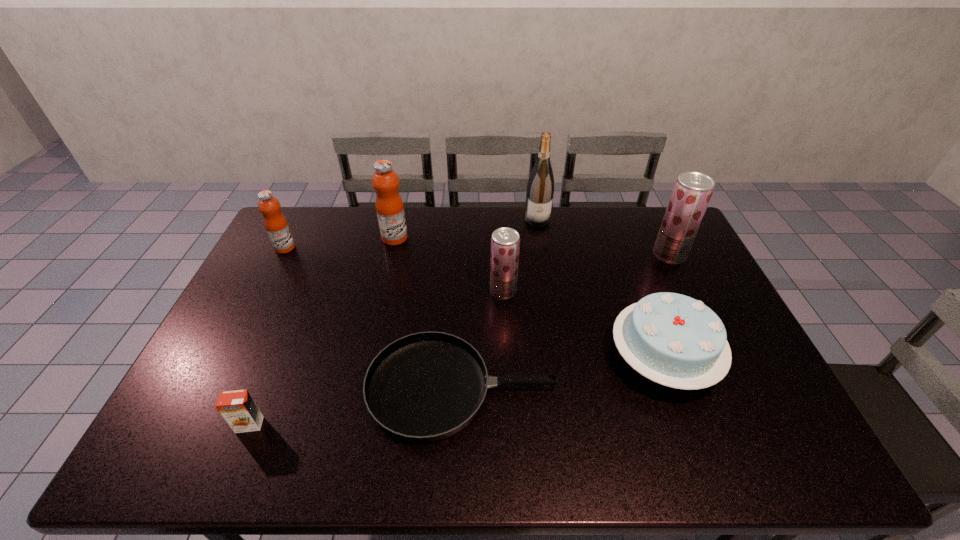
Image resolution: width=960 pixels, height=540 pixels. I want to click on vacant space that is in between the bigger strawberry fruit juice and the brown wine bottle, so click(x=603, y=237).

Locate an element on the screen. Image resolution: width=960 pixels, height=540 pixels. unoccupied area between the smaller orange fruit juice and the right strawberry fruit juice is located at coordinates (477, 251).

The width and height of the screenshot is (960, 540). I want to click on vacant space that is in between the left strawberry fruit juice and the right strawberry fruit juice, so click(587, 273).

Locate an element on the screen. free space between the brown wine bottle and the fifth farthest object is located at coordinates (520, 255).

Find the location of a particular element. This screenshot has width=960, height=540. vacant area that lies between the farthest object and the rightmost fruit juice is located at coordinates (603, 237).

This screenshot has width=960, height=540. I want to click on vacant space that's between the third fruit juice from left to right and the brown wine bottle, so (520, 255).

Choose which object is the fourth nearest neighbor to the farther strawberry fruit juice. Please provide its 2D coordinates. Your answer should be formatted as a tuple, i.e. [(x, y)], where the tuple contains the x and y coordinates of a point satisfying the conditions above.

[(424, 387)]

Find the location of a particular element. object that stands as the sixth closest to the bigger strawberry fruit juice is located at coordinates (276, 225).

Choose which fruit juice is the second nearest neighbor to the wine bottle. Please provide its 2D coordinates. Your answer should be formatted as a tuple, i.e. [(x, y)], where the tuple contains the x and y coordinates of a point satisfying the conditions above.

[(692, 191)]

Identify which fruit juice is the third nearest to the birthday cake. Please provide its 2D coordinates. Your answer should be formatted as a tuple, i.e. [(x, y)], where the tuple contains the x and y coordinates of a point satisfying the conditions above.

[(389, 206)]